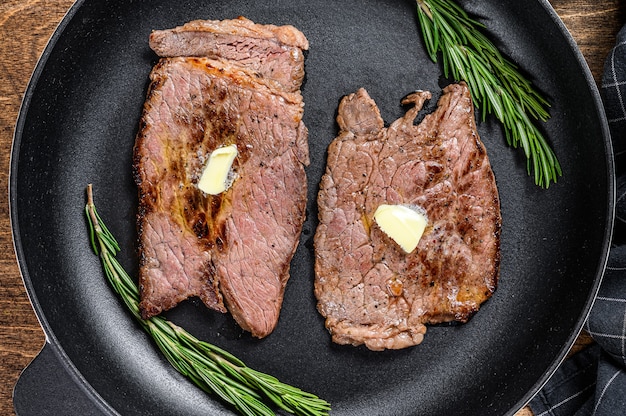
Identify the location of sprig of green plant for decoration. This screenshot has height=416, width=626. 195,355, 478,61.